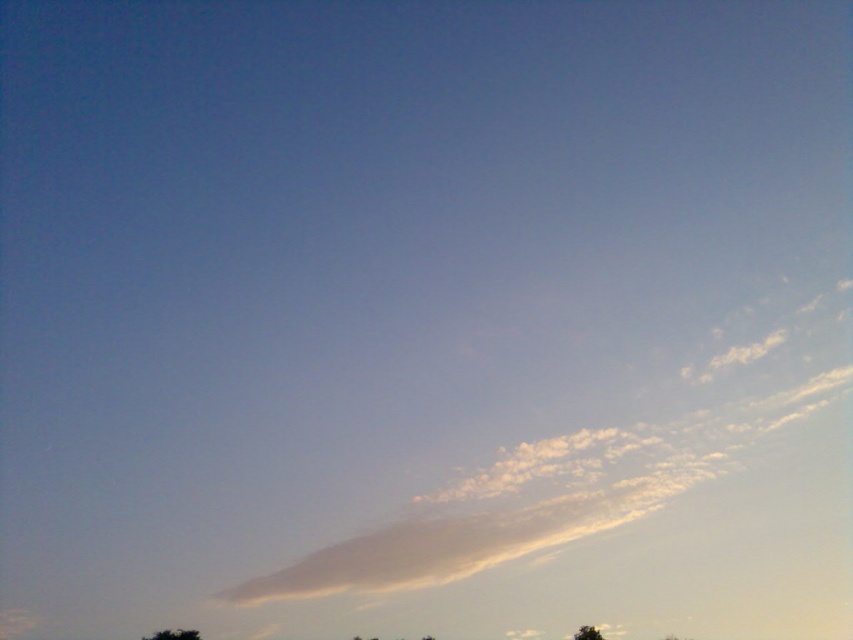
Question: Which is farther from the green leafy tree at lower center?

Choices:
 (A) white fluffy cloud at center
 (B) green leafy tree at lower right

Answer: (B)

Question: Which point is farther to the camera?

Choices:
 (A) (705, 472)
 (B) (196, 636)
 (C) (598, 632)

Answer: (A)

Question: Can you confirm if white fluffy cloud at center is smaller than green leafy tree at lower right?

Choices:
 (A) yes
 (B) no

Answer: (B)

Question: Does green leafy tree at lower center have a lesser width compared to green leafy tree at lower right?

Choices:
 (A) yes
 (B) no

Answer: (B)

Question: Which point is farther to the camera?

Choices:
 (A) (154, 637)
 (B) (582, 634)

Answer: (B)

Question: From the image, what is the correct spatial relationship of white fluffy cloud at center in relation to green leafy tree at lower center?

Choices:
 (A) right
 (B) left

Answer: (A)